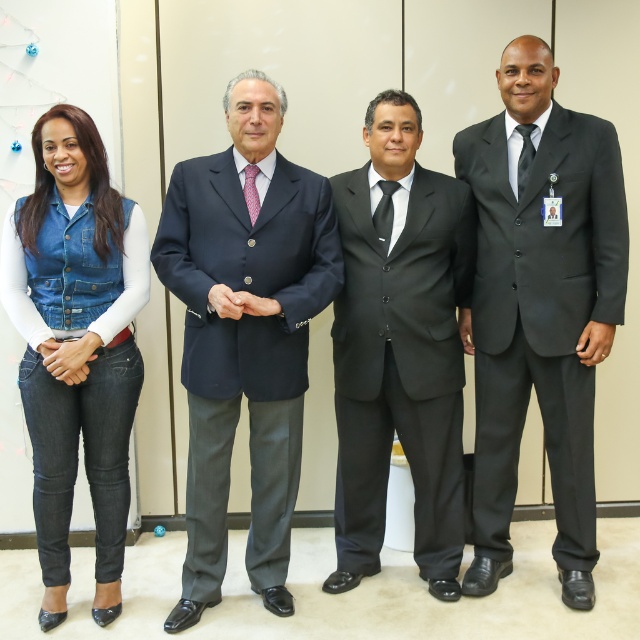
Question: Among these points, which one is nearest to the camera?

Choices:
 (A) (200, 490)
 (B) (92, 397)

Answer: (B)

Question: Is matte black suit at right positioned behind navy blue suit at center?

Choices:
 (A) yes
 (B) no

Answer: (A)

Question: In this image, where is navy blue suit at center located relative to black satin suit at center?

Choices:
 (A) above
 (B) below

Answer: (B)

Question: Estimate the real-world distances between objects in this image. Which object is farther from the black satin suit at center?

Choices:
 (A) matte black suit at right
 (B) navy blue suit at center

Answer: (B)

Question: Observing the image, what is the correct spatial positioning of matte black suit at right in reference to denim vest at left?

Choices:
 (A) right
 (B) left

Answer: (A)

Question: Among these objects, which one is nearest to the camera?

Choices:
 (A) matte black suit at right
 (B) black satin suit at center
 (C) navy blue suit at center
 (D) denim vest at left

Answer: (C)